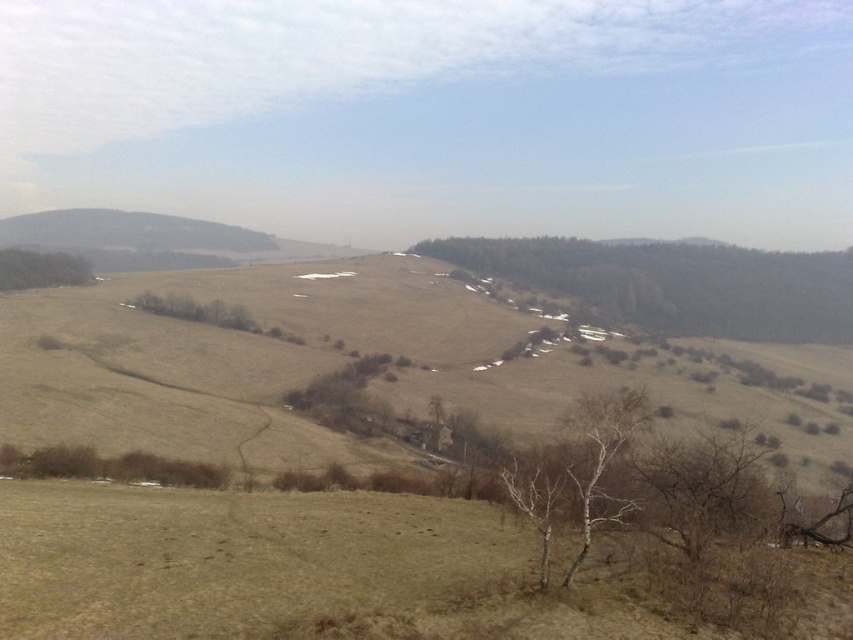
Does point (561, 264) lie in front of point (13, 257)?

No, (561, 264) is behind (13, 257).

Who is positioned more to the left, brown textured tree at center or green matte tree at left?

green matte tree at left is more to the left.

Identify the location of brown textured tree at center. The width and height of the screenshot is (853, 640). pyautogui.click(x=676, y=284).

You are a GUI agent. You are given a task and a screenshot of the screen. Output one action in this format:
    pyautogui.click(x=<x>, y=<y>)
    Task: Click on the brown textured tree at center
    This screenshot has height=640, width=853.
    Given the screenshot: What is the action you would take?
    pyautogui.click(x=676, y=284)